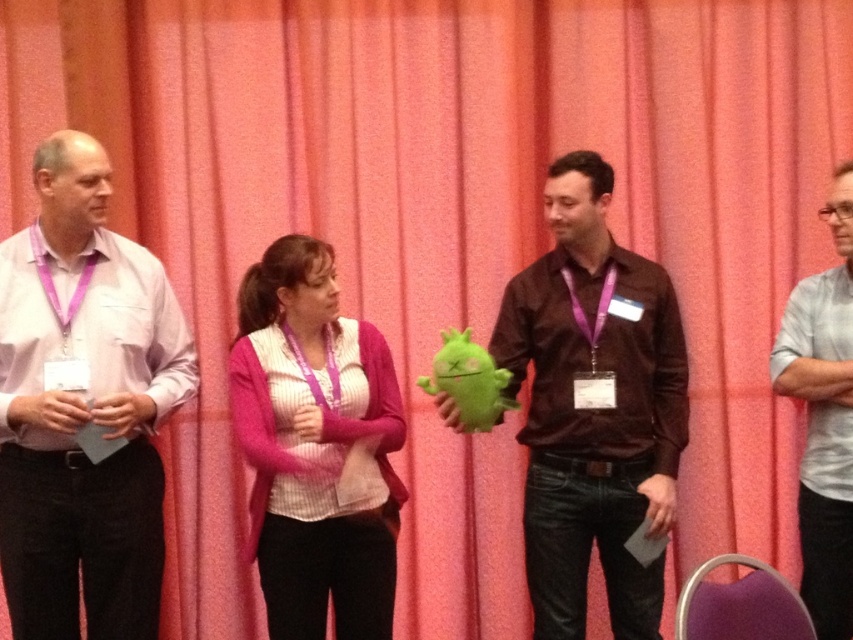
Question: Estimate the real-world distances between objects in this image. Which object is farther from the matte pink shirt at left?

Choices:
 (A) matte brown shirt at center
 (B) pink fuzzy sweater at center

Answer: (A)

Question: Which point appears closest to the camera in this image?

Choices:
 (A) (590, 364)
 (B) (260, 422)
 (C) (786, 381)

Answer: (B)

Question: Does matte pink shirt at left come in front of pink fuzzy sweater at center?

Choices:
 (A) no
 (B) yes

Answer: (B)

Question: Can you confirm if matte pink shirt at left is positioned to the right of matte brown shirt at center?

Choices:
 (A) yes
 (B) no

Answer: (B)

Question: From the image, what is the correct spatial relationship of matte brown shirt at center in relation to pink fuzzy sweater at center?

Choices:
 (A) below
 (B) above

Answer: (B)

Question: Which point is closer to the camera taking this photo?

Choices:
 (A) (656, 442)
 (B) (30, 349)

Answer: (B)